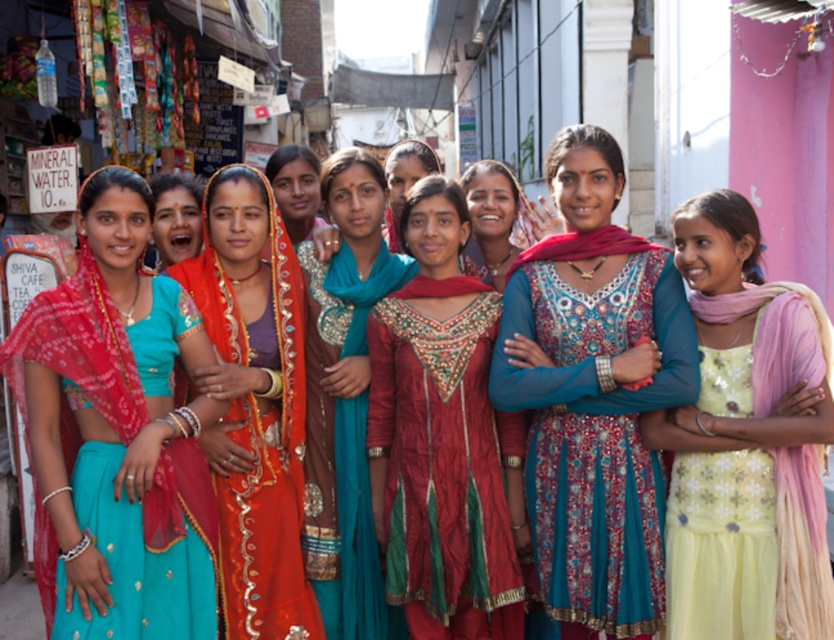
Who is higher up, light yellow sequined dress at center or shiny red dress at center?

light yellow sequined dress at center is above.

Is point (661, 442) positioned before point (398, 556)?

Yes, point (661, 442) is in front of point (398, 556).

You are a GUI agent. You are given a task and a screenshot of the screen. Output one action in this format:
    pyautogui.click(x=<x>, y=<y>)
    Task: Click on the light yellow sequined dress at center
    The image size is (834, 640).
    Given the screenshot: What is the action you would take?
    pyautogui.click(x=745, y=442)

Is point (615, 548) more distant than point (676, 618)?

That is True.

Is blue embroidered dress at center smaller than yellow sequined dress at right?

No.

Which is in front, point (576, 468) or point (739, 497)?

Point (739, 497)

Find the location of a particular element. blue embroidered dress at center is located at coordinates (594, 396).

Between light yellow sequined dress at center and matte teal dress at center, which one is positioned higher?

Positioned higher is matte teal dress at center.

Who is taller, light yellow sequined dress at center or matte teal dress at center?

light yellow sequined dress at center

Locate an element on the screen. light yellow sequined dress at center is located at coordinates (745, 442).

The width and height of the screenshot is (834, 640). What are the coordinates of `light yellow sequined dress at center` in the screenshot? It's located at (745, 442).